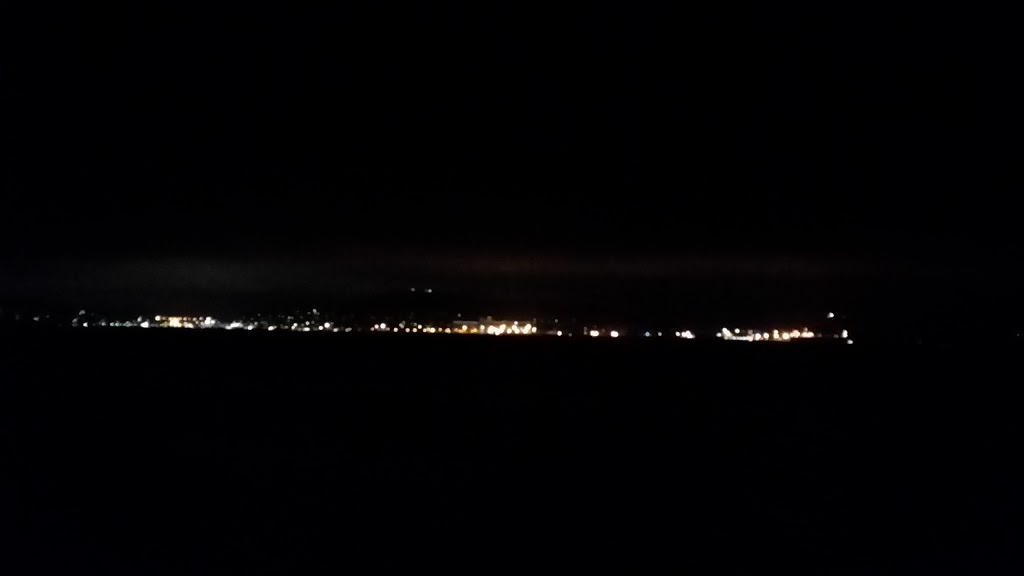
Locate an element on the screen. This screenshot has height=576, width=1024. light is located at coordinates (505, 336).